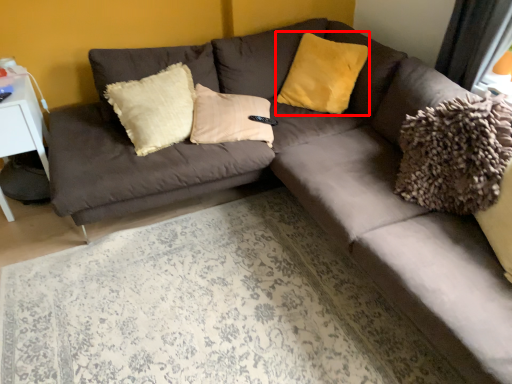
Question: From the image's perspective, what is the correct spatial relationship of pillow (annotated by the red box) in relation to table?

Choices:
 (A) above
 (B) below

Answer: (A)